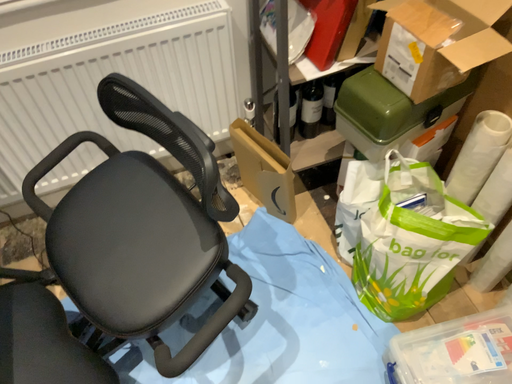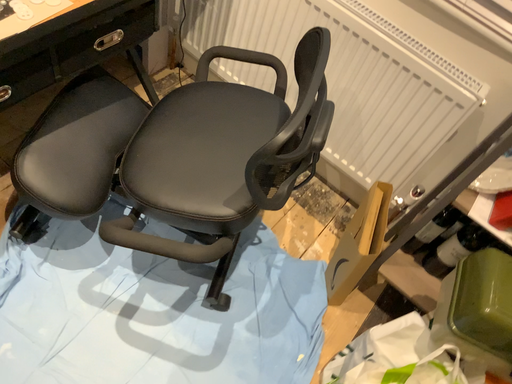
Question: How did the camera likely rotate when shooting the video?

Choices:
 (A) rotated upward
 (B) rotated downward

Answer: (A)